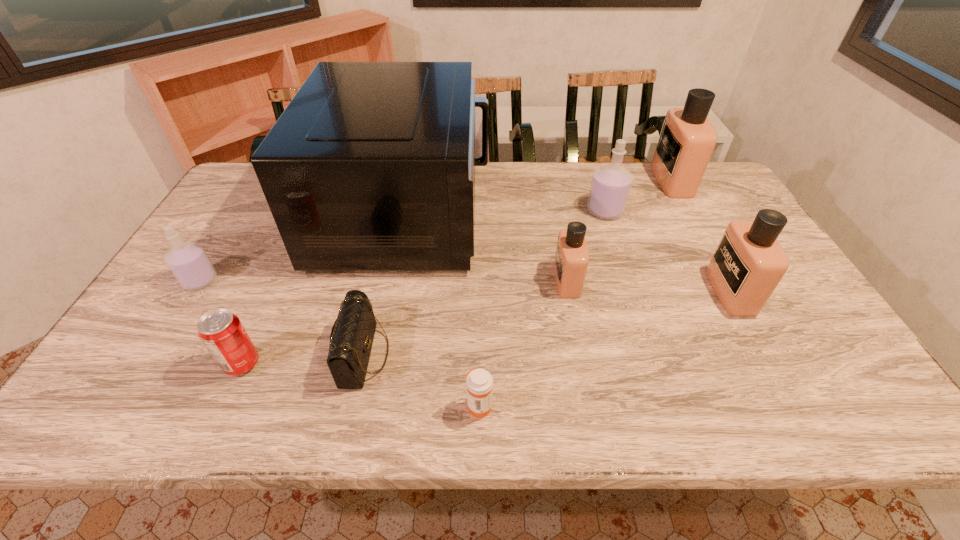
You are a GUI agent. You are given a task and a screenshot of the screen. Output one action in this format:
    pyautogui.click(x=<x>, y=<y>)
    Task: Click on the free point located on the front label of the second smallest beige perfume
    This screenshot has height=540, width=960.
    Given the screenshot: What is the action you would take?
    pyautogui.click(x=695, y=291)

At what (x,y) coordinates should I click in order to perform the action: click on vacant space located on the front label of the second smallest beige perfume. Please return your answer as a coordinate pair (x, y). The width and height of the screenshot is (960, 540). Looking at the image, I should click on (640, 291).

The height and width of the screenshot is (540, 960). In order to click on free space located 0.060m on the front label of the second smallest beige perfume in this screenshot , I will do `click(691, 291)`.

I want to click on vacant space located on the front label of the leftmost beige perfume, so click(x=491, y=280).

Locate an element on the screen. free point located 0.340m on the front label of the leftmost beige perfume is located at coordinates pos(426,280).

Locate an element on the screen. Image resolution: width=960 pixels, height=540 pixels. vacant region located on the front label of the leftmost beige perfume is located at coordinates (404, 280).

This screenshot has width=960, height=540. Identify the location of free point located on the front of the left purple perfume. (178, 316).

Locate an element on the screen. free spot located on the back of the seventh tallest object is located at coordinates (261, 322).

This screenshot has height=540, width=960. I want to click on vacant space situated 0.270m on the front flap of the clutch bag, so click(507, 354).

You are a GUI agent. You are given a task and a screenshot of the screen. Output one action in this format:
    pyautogui.click(x=<x>, y=<y>)
    Task: Click on the blank area located 0.200m on the back of the nearest object
    This screenshot has height=540, width=960.
    Given the screenshot: What is the action you would take?
    pyautogui.click(x=479, y=320)